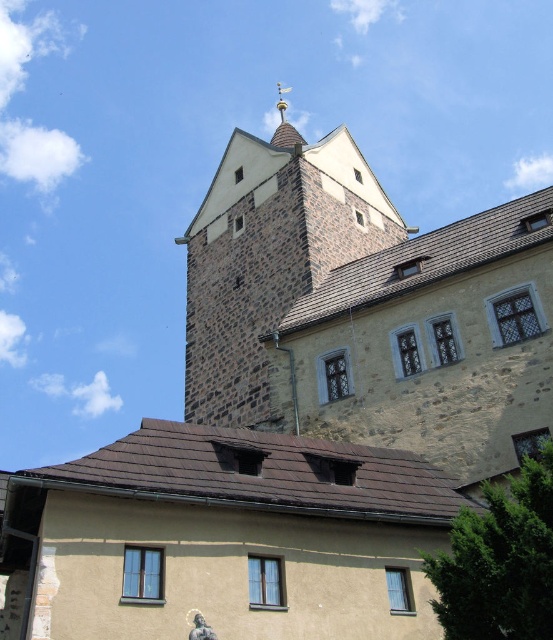
The height and width of the screenshot is (640, 553). Describe the element at coordinates (269, 259) in the screenshot. I see `rustic stone tower at upper center` at that location.

Can you confirm if rustic stone tower at upper center is shorter than gold spire at upper center?

Yes, rustic stone tower at upper center is shorter than gold spire at upper center.

Where is `rustic stone tower at upper center`? The height and width of the screenshot is (640, 553). rustic stone tower at upper center is located at coordinates (269, 259).